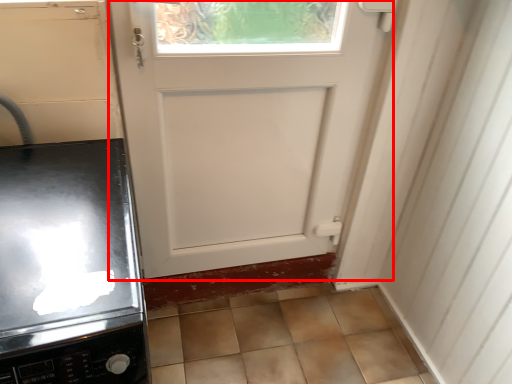
Question: Observing the image, what is the correct spatial positioning of door (annotated by the red box) in reference to home appliance?

Choices:
 (A) right
 (B) left

Answer: (A)